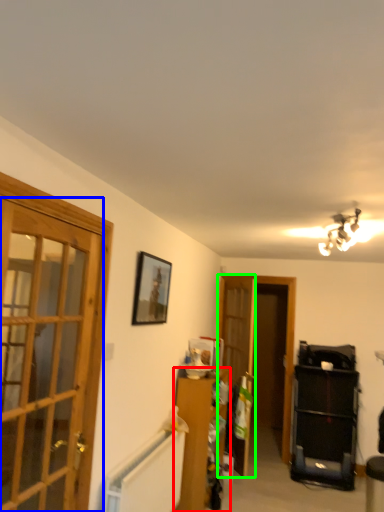
Question: Based on their relative distances, which object is farther from furniture (highlighted by a red box)? Choose from door (highlighted by a blue box) and screen door (highlighted by a green box).

Choices:
 (A) door
 (B) screen door

Answer: (A)